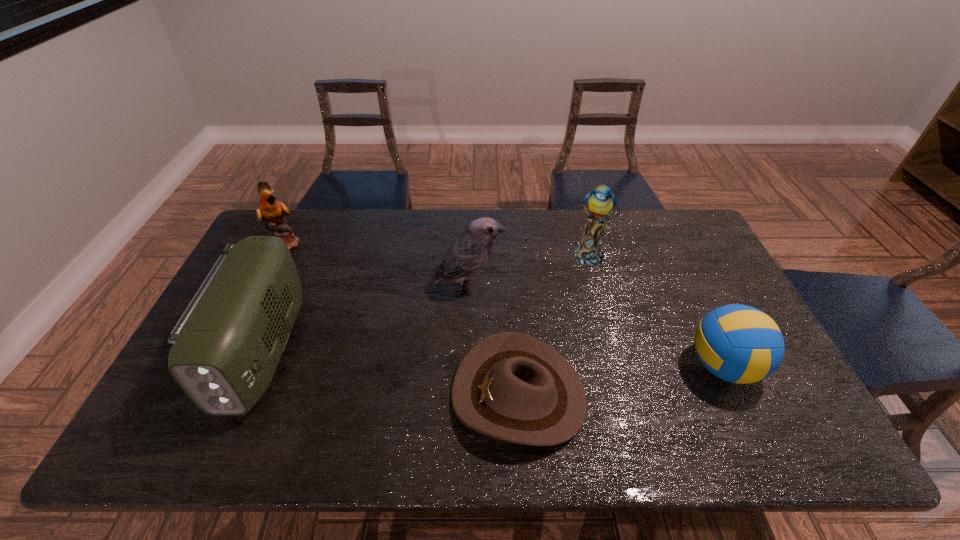
Find the location of `free point located 0.060m on the front-facing side of the radio_receiver`. free point located 0.060m on the front-facing side of the radio_receiver is located at coordinates [221, 447].

In order to click on vacant space located on the left of the rightmost object in this screenshot , I will do `click(660, 366)`.

The height and width of the screenshot is (540, 960). In order to click on vacant space located with a star on the front of the cowboy hat in this screenshot , I will do `click(383, 395)`.

Identify the location of free space located with a star on the front of the cowboy hat. The image size is (960, 540). (407, 395).

This screenshot has width=960, height=540. Identify the location of vacant space situated with a star on the front of the cowboy hat. (294, 395).

I want to click on radio_receiver located in the near edge section of the desktop, so click(x=226, y=347).

Identify the location of cowboy hat at the near edge. (511, 386).

The width and height of the screenshot is (960, 540). What are the coordinates of `parrot that is at the left edge` in the screenshot? It's located at (271, 211).

Identify the location of radio_receiver that is positioned at the left edge. The image size is (960, 540). (226, 347).

I want to click on object that is at the right edge, so click(740, 344).